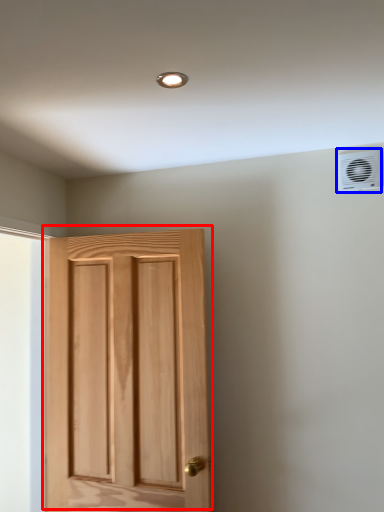
Question: Which object is further to the camera taking this photo, door (highlighted by a red box) or air conditioning (highlighted by a blue box)?

Choices:
 (A) door
 (B) air conditioning

Answer: (B)